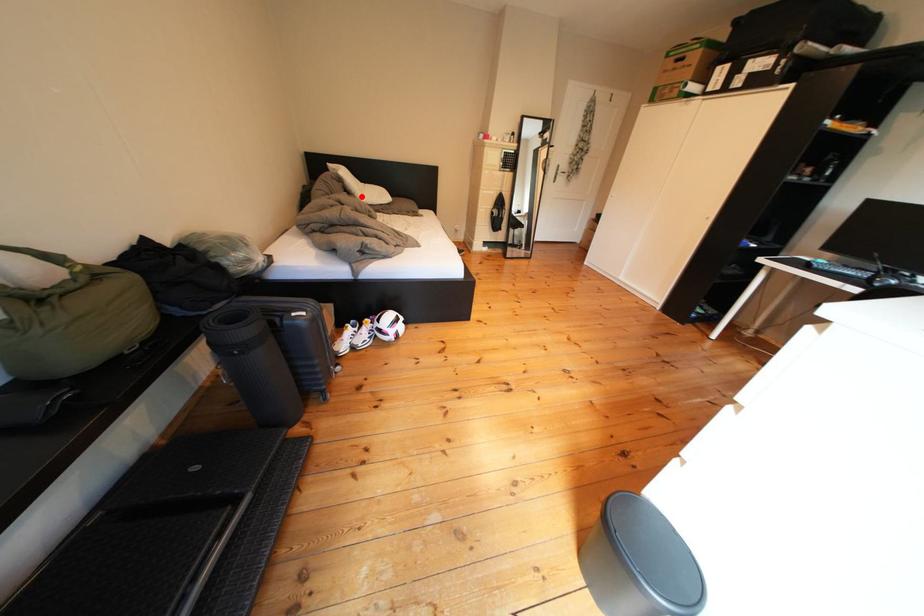
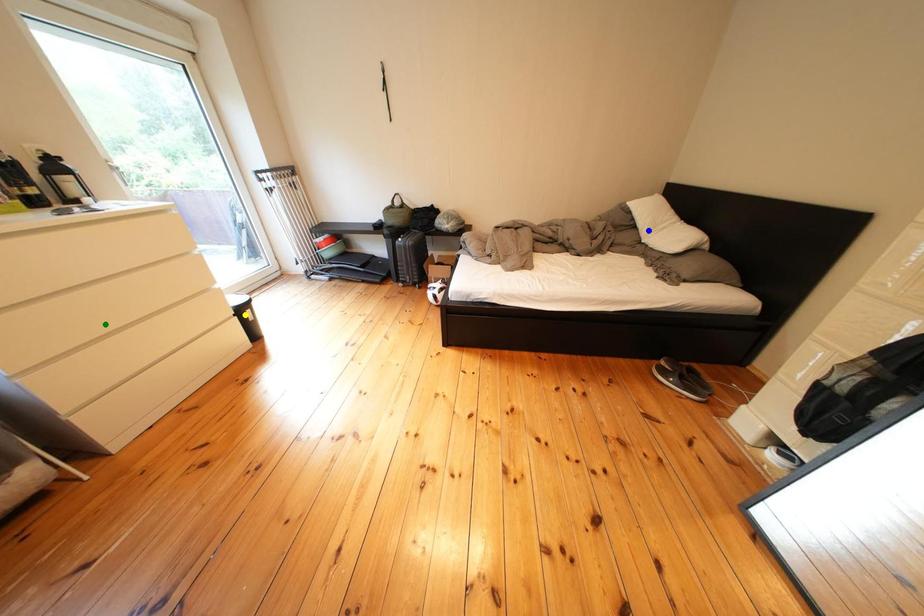
Question: I am providing you with two images of the same scene from different viewpoints. A red point is marked on the first image. You are given multiple points on the second image. In image 2, which mark is for the same physical point as the one in image 1?

Choices:
 (A) yellow point
 (B) green point
 (C) blue point

Answer: (C)